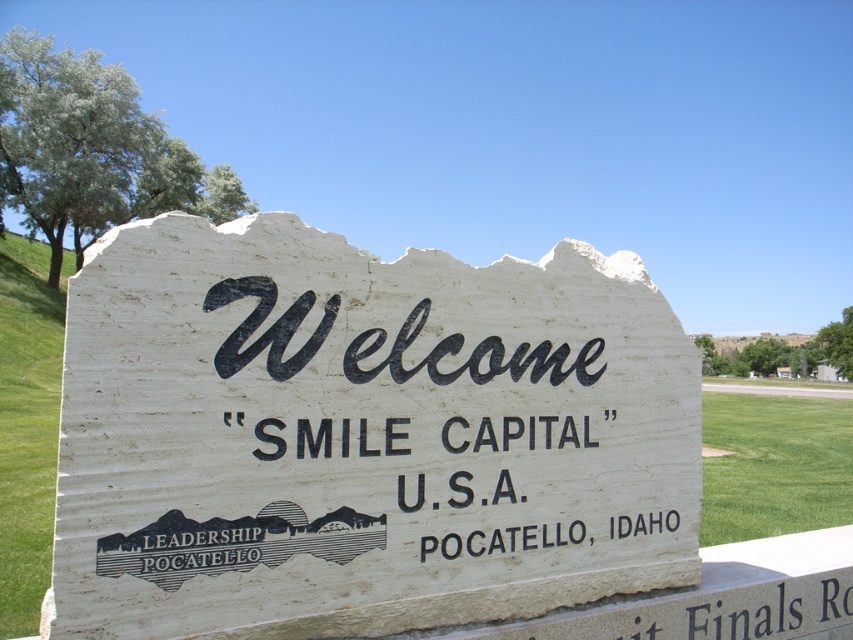
Question: Which point appears closest to the camera in this image?

Choices:
 (A) (720, 417)
 (B) (183, 260)

Answer: (B)

Question: Does white stone sign at center lie in front of green grass at lower right?

Choices:
 (A) yes
 (B) no

Answer: (A)

Question: Which point is farther to the camera?

Choices:
 (A) (724, 531)
 (B) (463, 369)

Answer: (A)

Question: Where is white stone sign at center located in relation to green grass at lower right in the image?

Choices:
 (A) left
 (B) right

Answer: (A)

Question: Can you confirm if white stone sign at center is thinner than green grass at lower right?

Choices:
 (A) yes
 (B) no

Answer: (A)